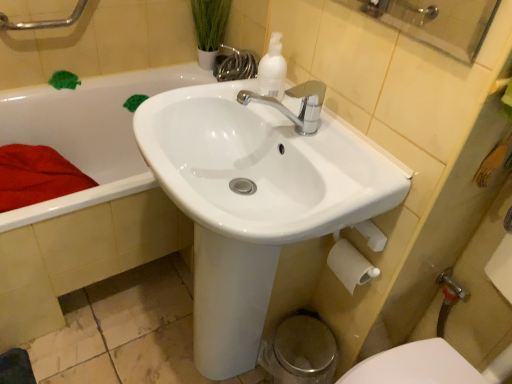
Question: From the image's perspective, is brushed metal grab bar at upper left above or below white glossy sink at center?

Choices:
 (A) above
 (B) below

Answer: (A)

Question: Is point (x=31, y=26) positioned closer to the camera than point (x=228, y=208)?

Choices:
 (A) farther
 (B) closer

Answer: (A)

Question: Considering the real-world distances, which object is closest to the brushed metal grab bar at upper left?

Choices:
 (A) white matte toilet paper at lower right
 (B) white matte pump bottle at upper center
 (C) white glossy bathtub at upper left
 (D) metallic silver faucet at lower right
 (E) white glossy sink at center

Answer: (C)

Question: Estimate the real-world distances between objects in this image. Which object is closer to the polished chrome faucet at center?

Choices:
 (A) brushed metal grab bar at upper left
 (B) white glossy bathtub at upper left
 (C) metallic silver faucet at lower right
 (D) white matte toilet paper at lower right
 (E) white glossy sink at center

Answer: (E)